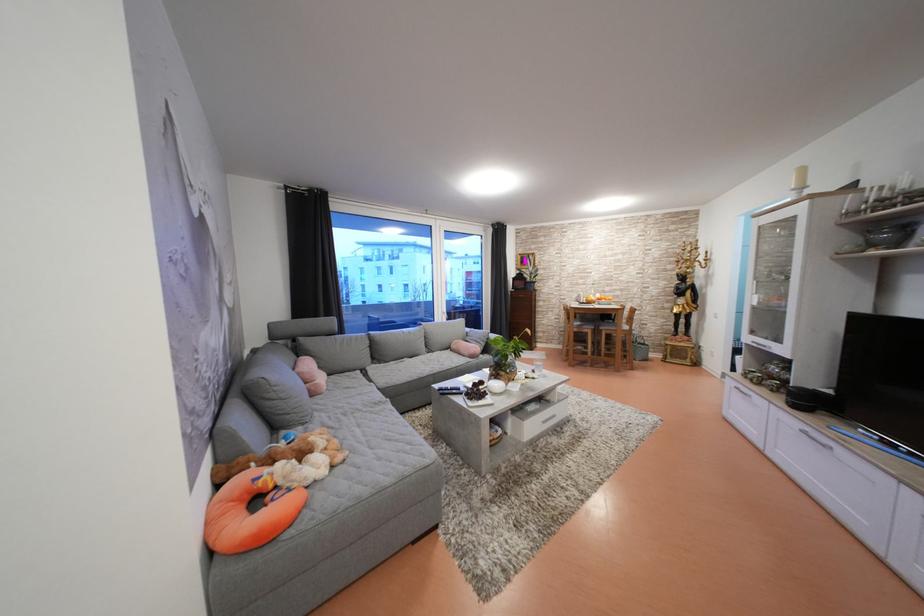
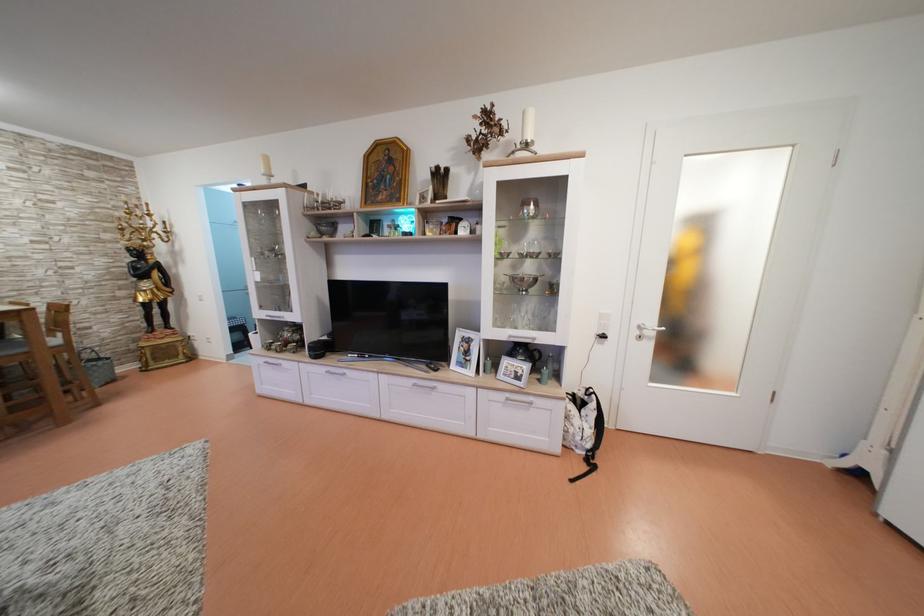
In the second image, find the point that corresponds to [648,346] in the first image.

(96, 361)